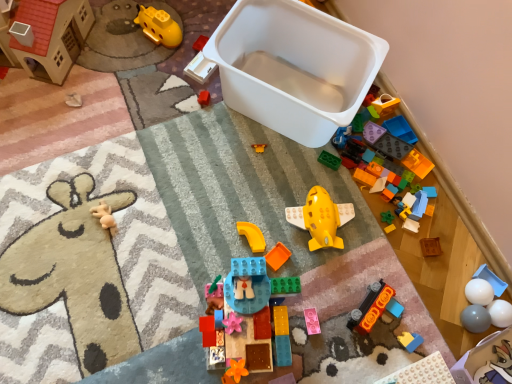
I want to click on free area in between orange matte car at lower right, the 8th toy in the right-to-left sequence, and cardboard house at upper left, the 1th toy positioned from the left, so click(x=167, y=154).